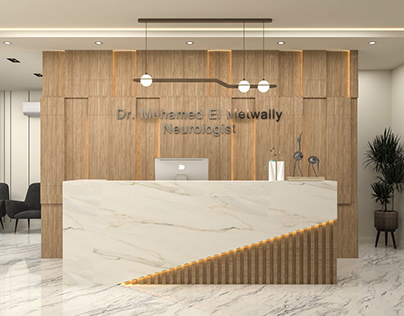
This screenshot has height=316, width=404. In order to click on countertop in this screenshot , I will do `click(261, 227)`.